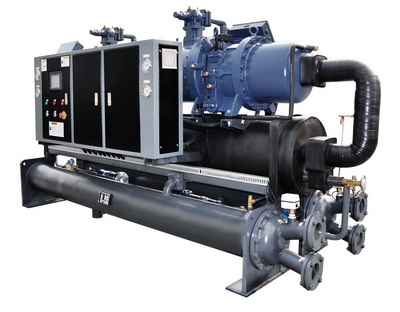
This screenshot has height=312, width=400. Find the location of `the left door of cabinet on large mechanical  device`. the left door of cabinet on large mechanical  device is located at coordinates [95, 101].